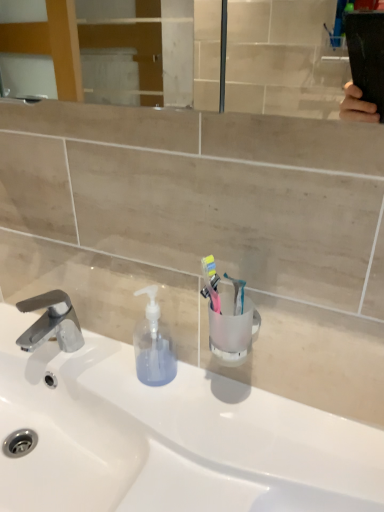
The image size is (384, 512). Describe the element at coordinates (211, 282) in the screenshot. I see `translucent plastic toothbrush at center, which appears as the second toothbrush when viewed from the right` at that location.

Identify the location of transparent plastic soap dispenser at center. This screenshot has height=512, width=384. click(x=153, y=345).

Find the location of a particular element. translucent plastic toothbrush at center, the second toothbrush from the left is located at coordinates (237, 294).

Describe the element at coordinates (237, 294) in the screenshot. I see `translucent plastic toothbrush at center, the second toothbrush from the left` at that location.

Find the location of a particular element. This screenshot has height=512, width=384. white glossy sink at center is located at coordinates (169, 438).

Can you tell me how much translucent plastic toothbrush at center, the second toothbrush from the left, and chrome metallic faucet at left differ in facing direction?

Result: The angular difference between translucent plastic toothbrush at center, the second toothbrush from the left, and chrome metallic faucet at left is 30.5 degrees.

Is the surface of translucent plastic toothbrush at center, the first toothbrush positioned from the right, in direct contact with chrome metallic faucet at left?

There is a gap between translucent plastic toothbrush at center, the first toothbrush positioned from the right, and chrome metallic faucet at left.

Who is more distant, translucent plastic toothbrush at center, the first toothbrush positioned from the right, or chrome metallic faucet at left?

chrome metallic faucet at left is further from the camera.

From the picture: Is chrome metallic faucet at left oriented away from white glossy sink at center?

No.

Considering their positions, is chrome metallic faucet at left located in front of or behind white glossy sink at center?

In the image, chrome metallic faucet at left appears behind white glossy sink at center.

Which of these two, chrome metallic faucet at left or white glossy sink at center, stands taller?

Standing taller between the two is white glossy sink at center.

Identify the location of soap dispenser that appears behind the translucent plastic toothbrush at center, which appears as the second toothbrush when viewed from the right. (153, 345).

From a real-world perspective, which object rests below the other?

transparent plastic soap dispenser at center.

Considering the positions of points (211, 268) and (145, 353), is point (211, 268) closer to camera compared to point (145, 353)?

That is True.

From the picture: Is transparent plastic soap dispenser at center completely or partially inside translucent plastic toothbrush at center, which appears as the second toothbrush when viewed from the right?

No.

From the image's perspective, is translucent plastic toothbrush at center, which appears as the second toothbrush when viewed from the right, located above or below translucent plastic toothbrush at center, the second toothbrush from the left?

From the image's perspective, translucent plastic toothbrush at center, which appears as the second toothbrush when viewed from the right, appears below translucent plastic toothbrush at center, the second toothbrush from the left.

Is translucent plastic toothbrush at center, which is counted as the first toothbrush, starting from the left, far away from translucent plastic toothbrush at center, the second toothbrush from the left?

No, translucent plastic toothbrush at center, which is counted as the first toothbrush, starting from the left, is in close proximity to translucent plastic toothbrush at center, the second toothbrush from the left.

Which object is thinner, translucent plastic toothbrush at center, which is counted as the first toothbrush, starting from the left, or translucent plastic toothbrush at center, the second toothbrush from the left?

With smaller width is translucent plastic toothbrush at center, the second toothbrush from the left.

Would you say translucent plastic toothbrush at center, the first toothbrush positioned from the right, is part of translucent plastic toothbrush at center, which appears as the second toothbrush when viewed from the right,'s contents?

No, translucent plastic toothbrush at center, the first toothbrush positioned from the right, is not inside translucent plastic toothbrush at center, which appears as the second toothbrush when viewed from the right.

Is transparent plastic soap dispenser at center situated inside translucent plastic toothbrush at center, the first toothbrush positioned from the right, or outside?

transparent plastic soap dispenser at center is located beyond the bounds of translucent plastic toothbrush at center, the first toothbrush positioned from the right.

Can you confirm if transparent plastic soap dispenser at center is smaller than translucent plastic toothbrush at center, the first toothbrush positioned from the right?

No.

Is transparent plastic soap dispenser at center shorter than translucent plastic toothbrush at center, the second toothbrush from the left?

No.

Can you confirm if transparent plastic soap dispenser at center is thinner than translucent plastic toothbrush at center, the first toothbrush positioned from the right?

In fact, transparent plastic soap dispenser at center might be wider than translucent plastic toothbrush at center, the first toothbrush positioned from the right.

In terms of width, does chrome metallic faucet at left look wider or thinner when compared to translucent plastic toothbrush at center, which appears as the second toothbrush when viewed from the right?

Considering their sizes, chrome metallic faucet at left looks broader than translucent plastic toothbrush at center, which appears as the second toothbrush when viewed from the right.

Does chrome metallic faucet at left have a larger size compared to translucent plastic toothbrush at center, which is counted as the first toothbrush, starting from the left?

Yes, chrome metallic faucet at left is bigger than translucent plastic toothbrush at center, which is counted as the first toothbrush, starting from the left.

From their relative heights in the image, would you say chrome metallic faucet at left is taller or shorter than translucent plastic toothbrush at center, which is counted as the first toothbrush, starting from the left?

Clearly, chrome metallic faucet at left is taller compared to translucent plastic toothbrush at center, which is counted as the first toothbrush, starting from the left.

Can you confirm if chrome metallic faucet at left is positioned to the left of translucent plastic toothbrush at center, which appears as the second toothbrush when viewed from the right?

Yes, chrome metallic faucet at left is to the left of translucent plastic toothbrush at center, which appears as the second toothbrush when viewed from the right.

Is translucent plastic toothbrush at center, which is counted as the first toothbrush, starting from the left, in front of or behind chrome metallic faucet at left in the image?

Visually, translucent plastic toothbrush at center, which is counted as the first toothbrush, starting from the left, is located in front of chrome metallic faucet at left.

Find the location of a particular element. tap located below the translucent plastic toothbrush at center, which appears as the second toothbrush when viewed from the right (from the image's perspective) is located at coordinates (51, 322).

Can you confirm if translucent plastic toothbrush at center, which appears as the second toothbrush when viewed from the right, is taller than chrome metallic faucet at left?

In fact, translucent plastic toothbrush at center, which appears as the second toothbrush when viewed from the right, may be shorter than chrome metallic faucet at left.

Can you tell me how much translucent plastic toothbrush at center, which is counted as the first toothbrush, starting from the left, and chrome metallic faucet at left differ in facing direction?

They differ by 0.324 degrees in their facing directions.

You are a GUI agent. You are given a task and a screenshot of the screen. Output one action in this format:
    pyautogui.click(x=<x>, y=<y>)
    Task: Click on the tap below the translucent plastic toothbrush at center, the first toothbrush positioned from the right (from the image's perspective)
    
    Given the screenshot: What is the action you would take?
    pyautogui.click(x=51, y=322)

Locate an element on the screen. tap above the white glossy sink at center (from the image's perspective) is located at coordinates (51, 322).

From the image, which object appears to be farther from white glossy sink at center, chrome metallic faucet at left or transparent plastic soap dispenser at center?

chrome metallic faucet at left.

Which object lies further to the anchor point transparent plastic soap dispenser at center, white glossy sink at center or translucent plastic toothbrush at center, the first toothbrush positioned from the right?

translucent plastic toothbrush at center, the first toothbrush positioned from the right, is positioned further to the anchor transparent plastic soap dispenser at center.

When comparing their distances from translucent plastic toothbrush at center, which appears as the second toothbrush when viewed from the right, does white glossy sink at center or chrome metallic faucet at left seem further?

chrome metallic faucet at left.

From the image, which object appears to be nearer to white glossy sink at center, translucent plastic toothbrush at center, the second toothbrush from the left, or translucent plastic toothbrush at center, which appears as the second toothbrush when viewed from the right?

translucent plastic toothbrush at center, which appears as the second toothbrush when viewed from the right.

Considering their positions, is chrome metallic faucet at left positioned further to transparent plastic soap dispenser at center than translucent plastic toothbrush at center, the second toothbrush from the left?

translucent plastic toothbrush at center, the second toothbrush from the left, lies further to transparent plastic soap dispenser at center than the other object.

Estimate the real-world distances between objects in this image. Which object is closer to translucent plastic toothbrush at center, the second toothbrush from the left, translucent plastic toothbrush at center, which appears as the second toothbrush when viewed from the right, or transparent plastic soap dispenser at center?

translucent plastic toothbrush at center, which appears as the second toothbrush when viewed from the right, is closer to translucent plastic toothbrush at center, the second toothbrush from the left.

From the picture: From the image, which object appears to be farther from transparent plastic soap dispenser at center, translucent plastic toothbrush at center, the first toothbrush positioned from the right, or white glossy sink at center?

translucent plastic toothbrush at center, the first toothbrush positioned from the right.

From the image, which object appears to be nearer to white glossy sink at center, translucent plastic toothbrush at center, which is counted as the first toothbrush, starting from the left, or transparent plastic soap dispenser at center?

transparent plastic soap dispenser at center is positioned closer to the anchor white glossy sink at center.

Where is `soap dispenser situated between chrome metallic faucet at left and translucent plastic toothbrush at center, which appears as the second toothbrush when viewed from the right, from left to right`? This screenshot has height=512, width=384. soap dispenser situated between chrome metallic faucet at left and translucent plastic toothbrush at center, which appears as the second toothbrush when viewed from the right, from left to right is located at coordinates click(153, 345).

Where is `soap dispenser between white glossy sink at center and chrome metallic faucet at left from front to back`? soap dispenser between white glossy sink at center and chrome metallic faucet at left from front to back is located at coordinates (153, 345).

At what (x,y) coordinates should I click in order to perform the action: click on toothbrush between translucent plastic toothbrush at center, the second toothbrush from the left, and white glossy sink at center from top to bottom. Please return your answer as a coordinate pair (x, y). This screenshot has height=512, width=384. Looking at the image, I should click on (211, 282).

This screenshot has height=512, width=384. Identify the location of sink situated between chrome metallic faucet at left and translucent plastic toothbrush at center, the second toothbrush from the left, from left to right. (169, 438).